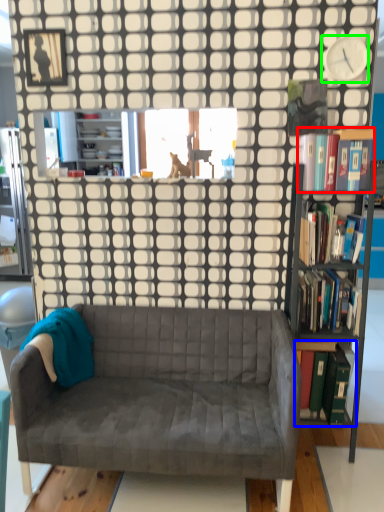
Question: Which object is the closest to the book (highlighted by a red box)? Choose among these: book (highlighted by a blue box) or clock (highlighted by a green box).

Choices:
 (A) book
 (B) clock

Answer: (B)